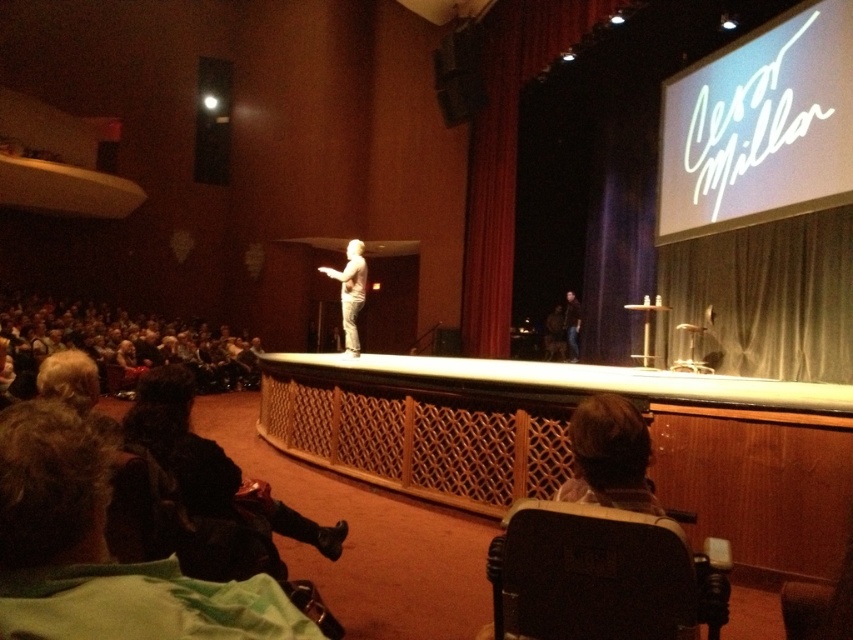
You are an event planner setting up a stage for a presentation. You have two items to place on the stage area described in the scene. The items are the matte black speaker at upper left and the smooth white statue at center. Given their sizes, which item should you place closer to the edge of the stage to ensure it doesn not block the speaker from the audience view?

The smooth white statue at center should be placed closer to the edge of the stage because the matte black speaker at upper left is wider. Placing the narrower smooth white statue at center near the edge will prevent it from obstructing the speaker who needs to be visible to the audience.